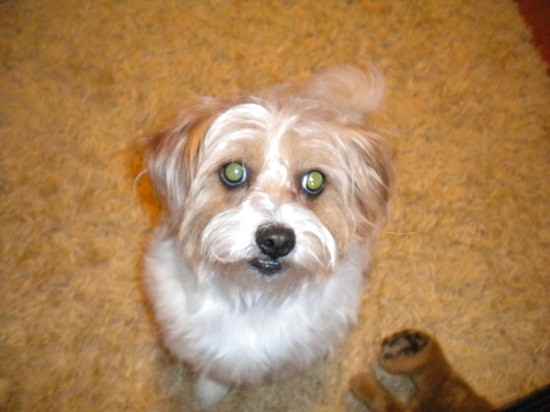
The width and height of the screenshot is (550, 412). Find the location of `light corner shadowing`. light corner shadowing is located at coordinates (15, 396), (12, 60), (546, 51).